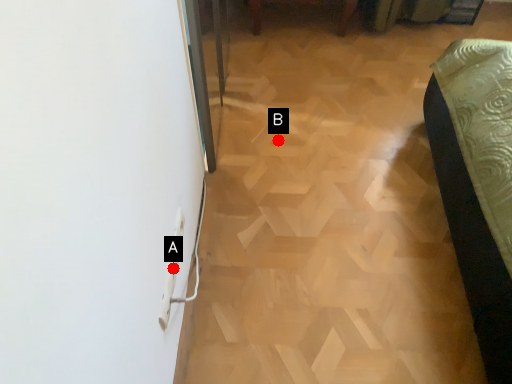
Question: Two points are circled on the image, labeled by A and B beside each circle. Which point is closer to the camera?

Choices:
 (A) A is closer
 (B) B is closer

Answer: (A)